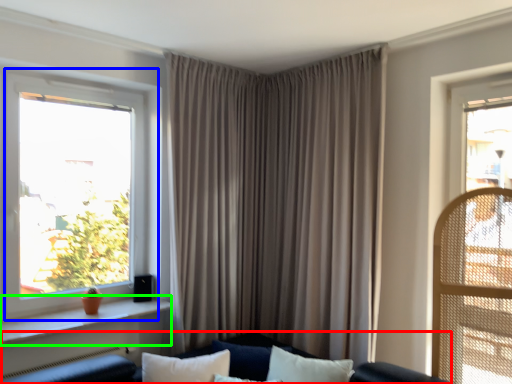
Question: Considering the real-world distances, which object is farthest from couch (highlighted by a red box)? window (highlighted by a blue box) or window sill (highlighted by a green box)?

Choices:
 (A) window
 (B) window sill

Answer: (A)